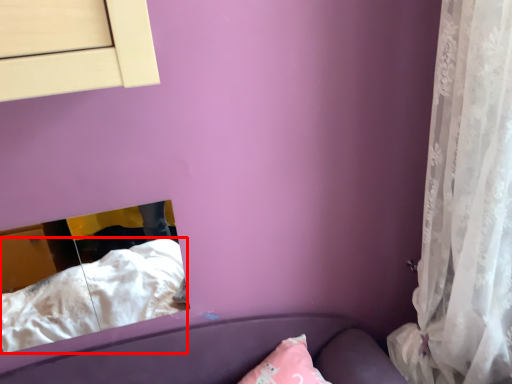
Question: In this image, where is sheet (annotated by the red box) located relative to curtain?

Choices:
 (A) right
 (B) left

Answer: (B)